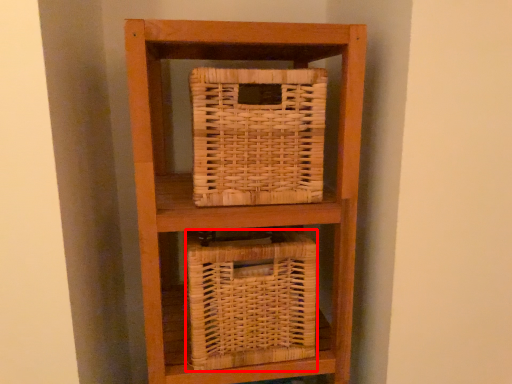
Question: Where is basket (annotated by the red box) located in relation to basket in the image?

Choices:
 (A) left
 (B) right

Answer: (A)